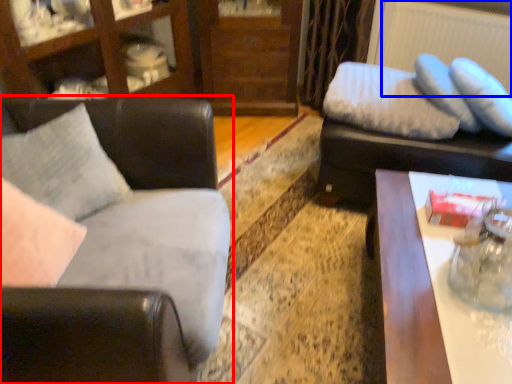
Question: Among these objects, which one is farthest to the camera, studio couch (highlighted by a red box) or radiator (highlighted by a blue box)?

Choices:
 (A) studio couch
 (B) radiator

Answer: (B)